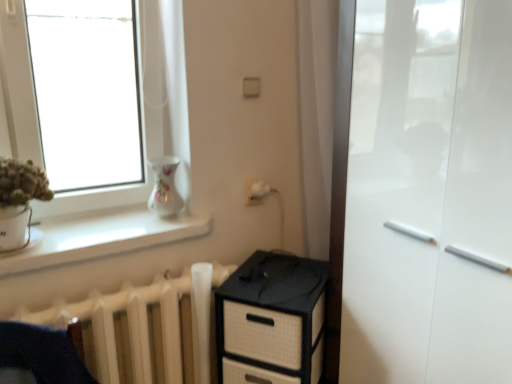
What do you see at coordinates (101, 237) in the screenshot? The width and height of the screenshot is (512, 384). I see `white smooth window sill at lower left` at bounding box center [101, 237].

Where is `black woven chest of drawers at lower center`? This screenshot has width=512, height=384. black woven chest of drawers at lower center is located at coordinates (271, 321).

What is the approximate width of porcelain floral vase at upper left?

The width of porcelain floral vase at upper left is 13.92 centimeters.

The image size is (512, 384). In order to click on white smooth window sill at lower left in this screenshot , I will do `click(101, 237)`.

The width and height of the screenshot is (512, 384). I want to click on chest of drawers below the white matte radiator at lower left (from a real-world perspective), so point(271,321).

From a real-world perspective, is white matte radiator at lower left physically below black woven chest of drawers at lower center?

No.

Looking at this image, would you say white matte radiator at lower left contains black woven chest of drawers at lower center?

Definitely not — black woven chest of drawers at lower center is not inside white matte radiator at lower left.

Who is smaller, porcelain floral vase at upper left or white matte radiator at lower left?

porcelain floral vase at upper left is smaller.

From a real-world perspective, relative to white matte radiator at lower left, is porcelain floral vase at upper left vertically above or below?

Clearly, from a real-world perspective, porcelain floral vase at upper left is above white matte radiator at lower left.

Is porcelain floral vase at upper left closer to the viewer compared to white matte radiator at lower left?

That is False.

Can you confirm if porcelain floral vase at upper left is wider than white matte radiator at lower left?

Incorrect, the width of porcelain floral vase at upper left does not surpass that of white matte radiator at lower left.

Considering the points (293, 270) and (131, 217), which point is behind, point (293, 270) or point (131, 217)?

The point (131, 217) is farther from the camera.

Does black woven chest of drawers at lower center appear on the right side of white smooth window sill at lower left?

Correct, you'll find black woven chest of drawers at lower center to the right of white smooth window sill at lower left.

Can you confirm if black woven chest of drawers at lower center is bigger than white smooth window sill at lower left?

Yes, black woven chest of drawers at lower center is bigger than white smooth window sill at lower left.

Which is behind, black woven chest of drawers at lower center or white smooth window sill at lower left?

Positioned behind is black woven chest of drawers at lower center.

Does black woven chest of drawers at lower center have a greater height compared to porcelain floral vase at upper left?

Yes.

In the image, is black woven chest of drawers at lower center positioned in front of or behind porcelain floral vase at upper left?

→ black woven chest of drawers at lower center is positioned closer to the viewer than porcelain floral vase at upper left.

Is black woven chest of drawers at lower center positioned with its back to porcelain floral vase at upper left?

No, black woven chest of drawers at lower center is not facing the opposite direction of porcelain floral vase at upper left.

Considering the positions of point (272, 335) and point (165, 202), is point (272, 335) closer or farther from the camera than point (165, 202)?

Point (272, 335).

Considering the points (215, 278) and (159, 168), which point is behind, point (215, 278) or point (159, 168)?

The point (215, 278) is farther from the camera.

Based on the photo, which of these two, white matte radiator at lower left or porcelain floral vase at upper left, is thinner?

porcelain floral vase at upper left.

Which object is further away from the camera taking this photo, white matte radiator at lower left or porcelain floral vase at upper left?

porcelain floral vase at upper left is behind.

Is white matte radiator at lower left positioned beyond the bounds of porcelain floral vase at upper left?

Yes, white matte radiator at lower left is not within porcelain floral vase at upper left.

Does white smooth window sill at lower left contain white glossy cabinet at right?

Actually, white glossy cabinet at right is outside white smooth window sill at lower left.

How different are the orientations of white smooth window sill at lower left and white glossy cabinet at right in degrees?

91 degrees separate the facing orientations of white smooth window sill at lower left and white glossy cabinet at right.

Is white smooth window sill at lower left shorter than white glossy cabinet at right?

Indeed, white smooth window sill at lower left has a lesser height compared to white glossy cabinet at right.

From the image's perspective, who appears lower, white smooth window sill at lower left or white glossy cabinet at right?

white glossy cabinet at right is shown below in the image.

Which is farther from the camera, (156, 217) or (179, 207)?

The point (156, 217) is farther.

Which of these two, white smooth window sill at lower left or porcelain floral vase at upper left, stands shorter?

white smooth window sill at lower left.

Would you say white smooth window sill at lower left is a long distance from porcelain floral vase at upper left?

No, there isn't a large distance between white smooth window sill at lower left and porcelain floral vase at upper left.

Locate an element on the screen. chest of drawers that appears on the right of white matte radiator at lower left is located at coordinates (271, 321).

Locate an element on the screen. Image resolution: width=512 pixels, height=384 pixels. radiator below the porcelain floral vase at upper left (from the image's perspective) is located at coordinates (135, 332).

From the image, which object appears to be farther from white glossy cabinet at right, black woven chest of drawers at lower center or white matte radiator at lower left?

white matte radiator at lower left is positioned further to the anchor white glossy cabinet at right.

From the image, which object appears to be nearer to porcelain floral vase at upper left, black woven chest of drawers at lower center or white glossy cabinet at right?

black woven chest of drawers at lower center is positioned closer to the anchor porcelain floral vase at upper left.

From the image, which object appears to be farther from white smooth window sill at lower left, white matte radiator at lower left or black woven chest of drawers at lower center?

Based on the image, black woven chest of drawers at lower center appears to be further to white smooth window sill at lower left.

Based on their spatial positions, is white matte radiator at lower left or white glossy cabinet at right further from black woven chest of drawers at lower center?

white glossy cabinet at right.

From the image, which object appears to be nearer to black woven chest of drawers at lower center, white matte radiator at lower left or white smooth window sill at lower left?

white matte radiator at lower left is closer to black woven chest of drawers at lower center.

Based on their spatial positions, is white matte radiator at lower left or white glossy cabinet at right further from white smooth window sill at lower left?

Based on the image, white glossy cabinet at right appears to be further to white smooth window sill at lower left.

When comparing their distances from black woven chest of drawers at lower center, does porcelain floral vase at upper left or white glossy cabinet at right seem further?

porcelain floral vase at upper left lies further to black woven chest of drawers at lower center than the other object.

Considering their positions, is white matte radiator at lower left positioned further to white glossy cabinet at right than white smooth window sill at lower left?

Based on the image, white smooth window sill at lower left appears to be further to white glossy cabinet at right.

Identify the location of vase located between white smooth window sill at lower left and white glossy cabinet at right in the left-right direction. This screenshot has width=512, height=384. (165, 187).

Find the location of a particular element. The image size is (512, 384). the chest of drawers situated between white matte radiator at lower left and white glossy cabinet at right from left to right is located at coordinates (271, 321).

The height and width of the screenshot is (384, 512). In order to click on radiator situated between white smooth window sill at lower left and white glossy cabinet at right from left to right in this screenshot , I will do `click(135, 332)`.

Image resolution: width=512 pixels, height=384 pixels. In order to click on the chest of drawers situated between white smooth window sill at lower left and white glossy cabinet at right from left to right in this screenshot , I will do `click(271, 321)`.